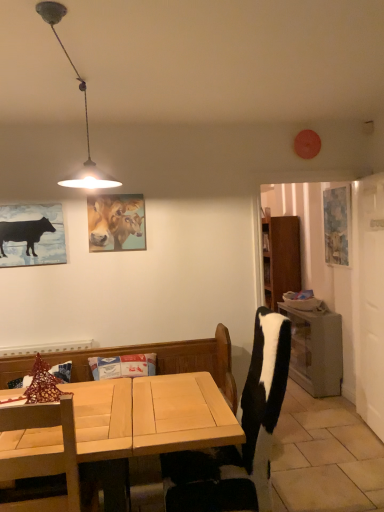
Identify the location of free point above light wood desk at lower left (from a real-world perspective). The width and height of the screenshot is (384, 512). point(123,407).